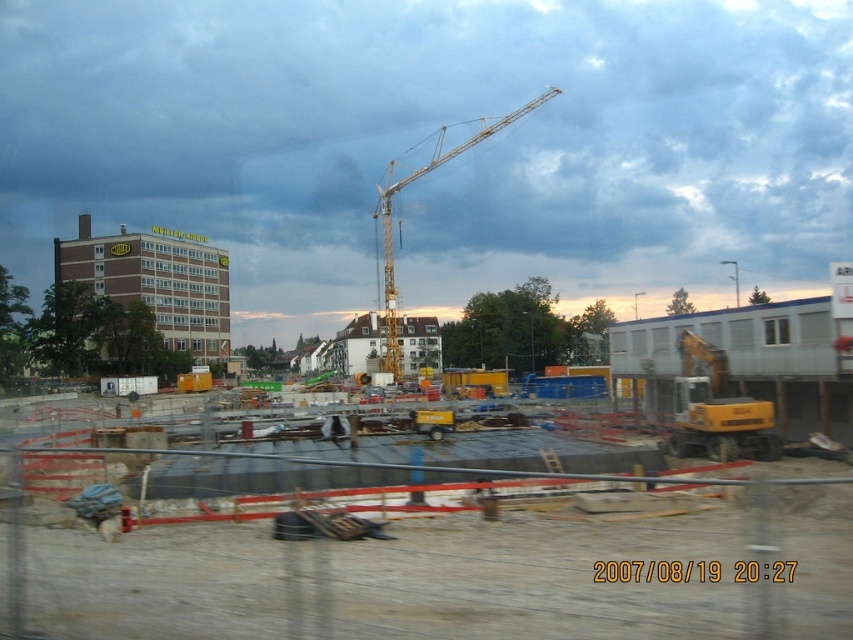
Is yellow metallic crane at center smaller than black plastic website at center?

No.

Does yellow metallic crane at center lie behind black plastic website at center?

Yes, it is behind black plastic website at center.

Find the location of a particular element. yellow metallic crane at center is located at coordinates (392, 218).

Who is shorter, brown brick building at left or yellow metallic crane at center?

Standing shorter between the two is brown brick building at left.

Image resolution: width=853 pixels, height=640 pixels. Describe the element at coordinates (155, 282) in the screenshot. I see `brown brick building at left` at that location.

Identify the location of brown brick building at left. The image size is (853, 640). (155, 282).

Is yellow metallic truck at center taller than brown brick building at left?

In fact, yellow metallic truck at center may be shorter than brown brick building at left.

Is yellow metallic truck at center thinner than brown brick building at left?

Indeed, yellow metallic truck at center has a lesser width compared to brown brick building at left.

Between point (718, 605) and point (180, 244), which one is positioned in front?

Point (718, 605)

At what (x,y) coordinates should I click in order to perform the action: click on yellow metallic truck at center. Please return your answer as a coordinate pair (x, y). Looking at the image, I should click on (426, 547).